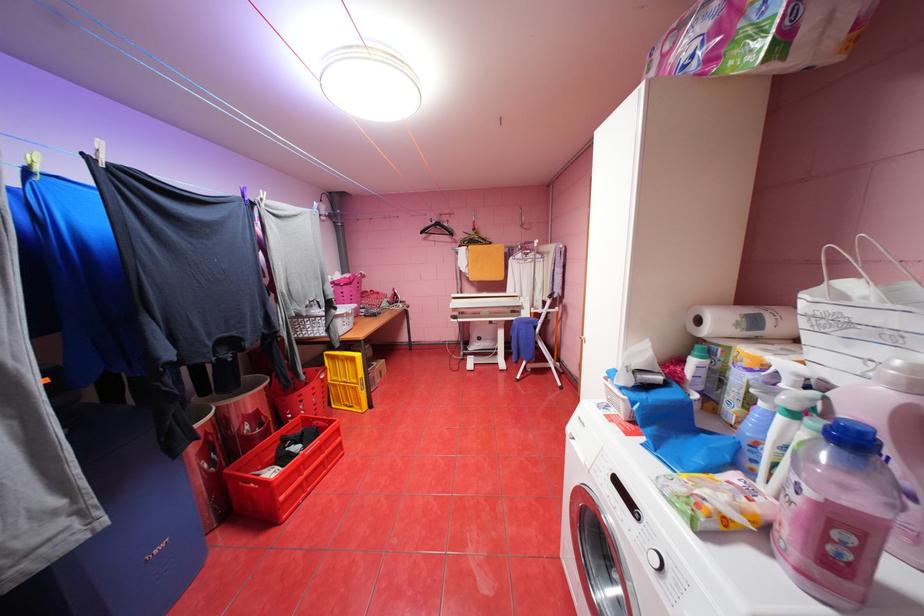
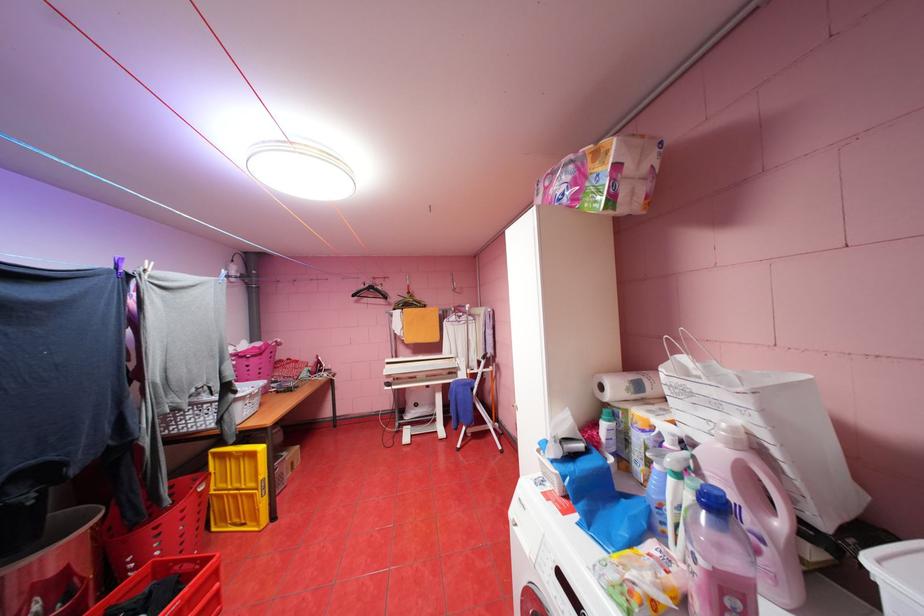
In the second image, find the point that corresponds to point 311,377 in the first image.

(176, 501)